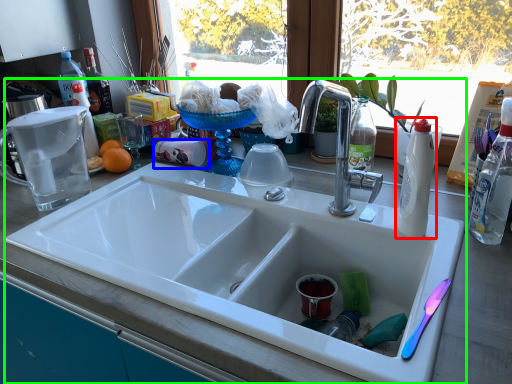
Question: Which is farther away from bottle (highlighted by a red box)? coffee cup (highlighted by a blue box) or sink (highlighted by a green box)?

Choices:
 (A) coffee cup
 (B) sink

Answer: (A)